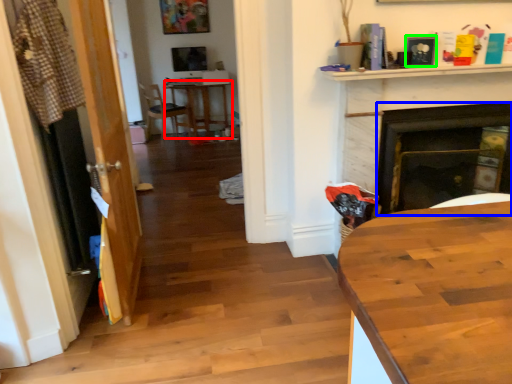
Question: Estimate the real-world distances between objects in this image. Which object is closer to round table (highlighted by a red box), fireplace (highlighted by a blue box) or picture frame (highlighted by a green box)?

Choices:
 (A) fireplace
 (B) picture frame

Answer: (A)